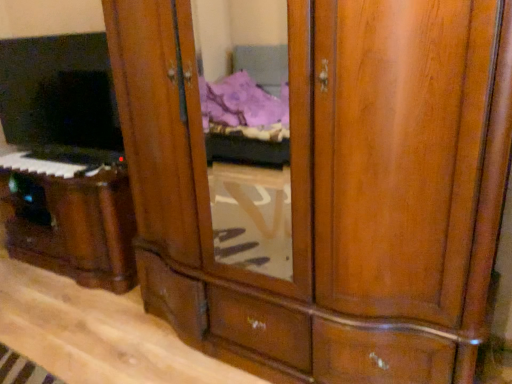
Question: From the image's perspective, relative to wooden piano at lower left, is matte black keyboard at left above or below?

Choices:
 (A) above
 (B) below

Answer: (A)

Question: Is matte black keyboard at left bigger or smaller than wooden piano at lower left?

Choices:
 (A) small
 (B) big

Answer: (A)

Question: Estimate the real-world distances between objects in this image. Which object is closer to the matte black tv at left?

Choices:
 (A) wooden piano at lower left
 (B) matte black keyboard at left

Answer: (A)

Question: Estimate the real-world distances between objects in this image. Which object is closer to the matte black keyboard at left?

Choices:
 (A) wooden piano at lower left
 (B) matte black tv at left

Answer: (B)